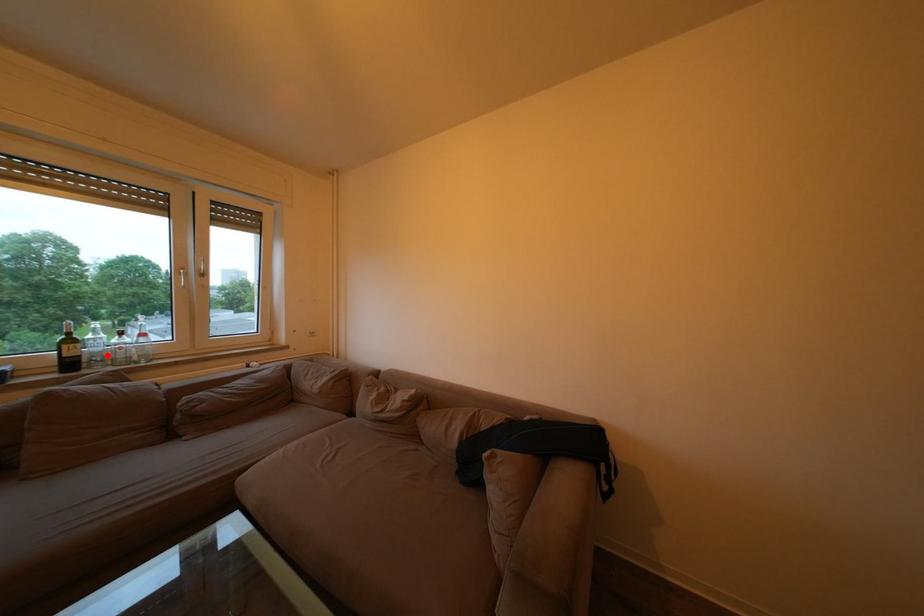
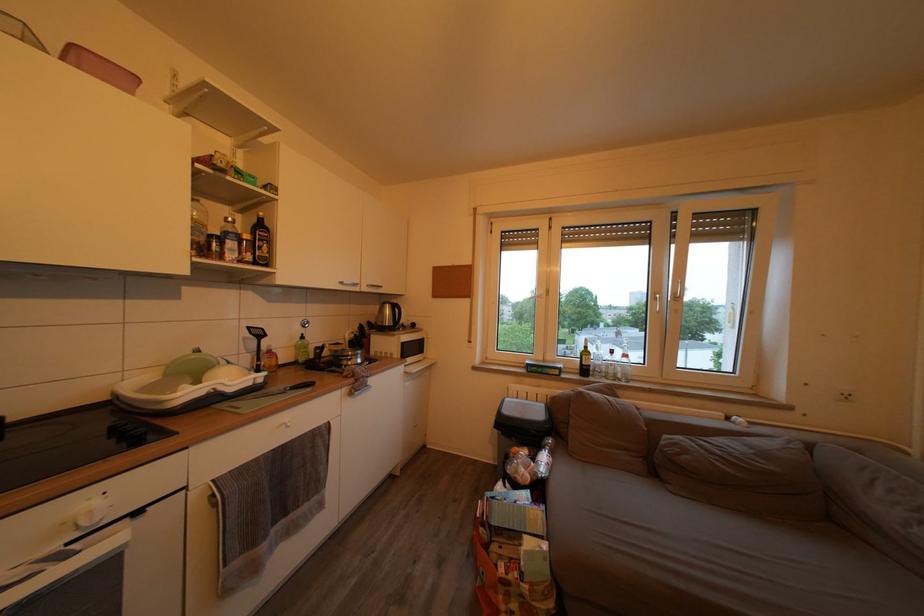
Where in the second image is the point corresponding to the highlighted location from the first image?

(608, 369)